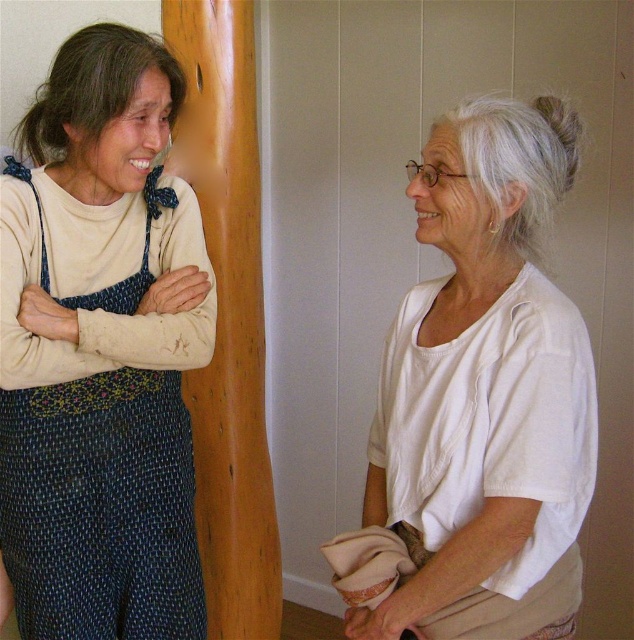
You are an interior designer assessing the spatial compatibility of items in a room. Given the blue woven apron at left and the white cotton sleeve at upper left, which object occupies more space in the scene?

The blue woven apron at left occupies more space in the scene as it has a larger size compared to the white cotton sleeve at upper left.

You are standing in the room and want to place a decorative hook exactly at the center of the blue woven apron at left. What are the coordinates where you should place the hook?

The coordinates for the center of the blue woven apron at left are at point (100,508).